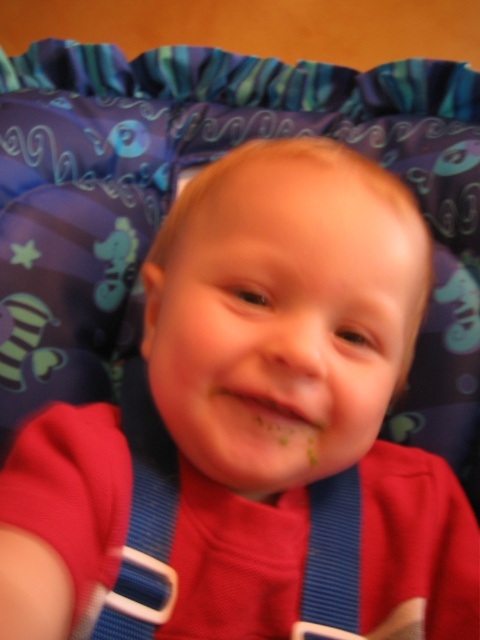
Is point (292, 308) closer to camera compared to point (130, 545)?

Yes, point (292, 308) is closer to viewer.

Does smooth skin face at center have a larger size compared to blue fabric strap at center?

Indeed, smooth skin face at center has a larger size compared to blue fabric strap at center.

This screenshot has height=640, width=480. In order to click on smooth skin face at center in this screenshot , I will do `click(280, 323)`.